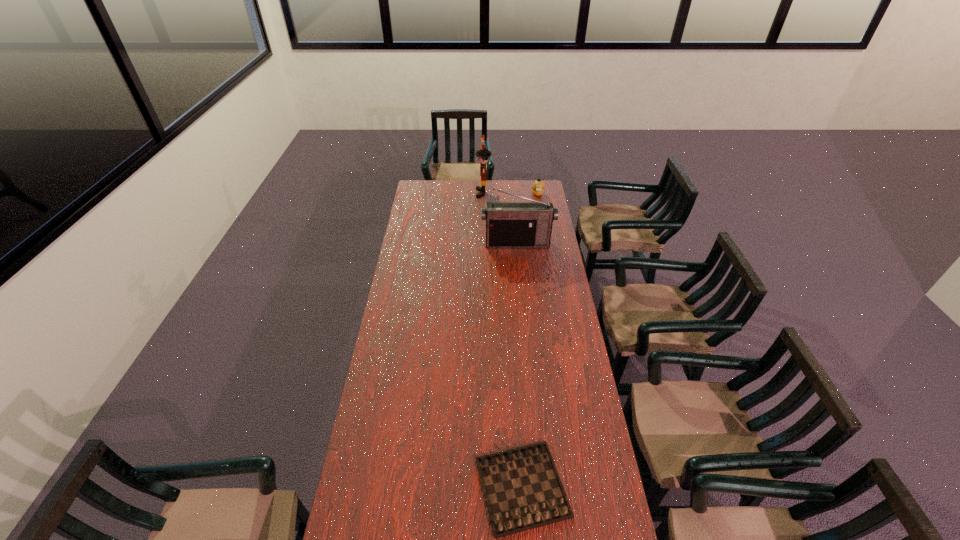
Find the location of a particular element. This screenshot has height=540, width=960. nutcracker is located at coordinates (482, 154).

You are a GUI agent. You are given a task and a screenshot of the screen. Output one action in this format:
    pyautogui.click(x=<x>, y=<y>)
    Task: Click on the third farthest object
    
    Given the screenshot: What is the action you would take?
    pyautogui.click(x=508, y=224)

This screenshot has width=960, height=540. What are the coordinates of `the third tallest object` in the screenshot? It's located at click(x=538, y=186).

Locate an element on the screen. The width and height of the screenshot is (960, 540). chessboard is located at coordinates (522, 488).

The image size is (960, 540). In order to click on the nearest object in this screenshot , I will do `click(522, 488)`.

In order to click on free space located on the front-facing side of the nutcracker in this screenshot , I will do `click(444, 193)`.

You are a GUI agent. You are given a task and a screenshot of the screen. Output one action in this format:
    pyautogui.click(x=<x>, y=<y>)
    Task: Click on the free point located 0.070m on the front-facing side of the nutcracker
    Image resolution: width=960 pixels, height=540 pixels.
    Given the screenshot: What is the action you would take?
    pyautogui.click(x=465, y=193)

At what (x,y) coordinates should I click in order to perform the action: click on free region located on the front-facing side of the nutcracker. Please return your answer as a coordinate pair (x, y). This screenshot has height=540, width=960. Looking at the image, I should click on (464, 193).

Locate an element on the screen. The image size is (960, 540). vacant point located 0.130m on the front-facing side of the radio receiver is located at coordinates (519, 264).

This screenshot has width=960, height=540. I want to click on vacant space located on the face of the second shortest object, so coord(541,215).